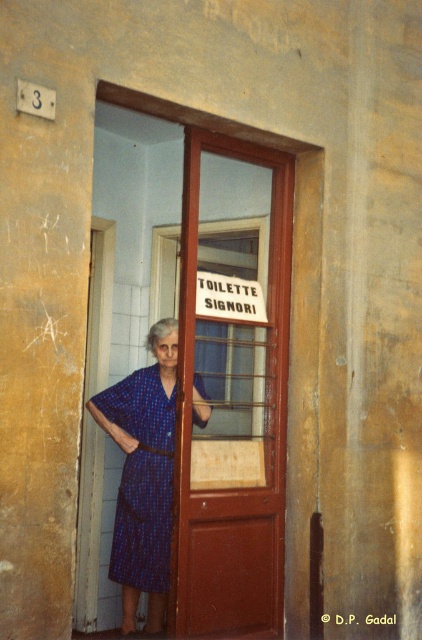
Which is behind, point (229, 289) or point (165, 406)?

The point (165, 406) is behind.

Does brown wooden door at center appear on the right side of blue printed dress at center?

Indeed, brown wooden door at center is positioned on the right side of blue printed dress at center.

Is point (238, 243) positioned behind point (151, 486)?

Yes, it is behind point (151, 486).

You are a GUI agent. You are given a task and a screenshot of the screen. Output one action in this format:
    pyautogui.click(x=<x>, y=<y>)
    Task: Click on the brown wooden door at center
    
    Given the screenshot: What is the action you would take?
    (x=230, y=388)